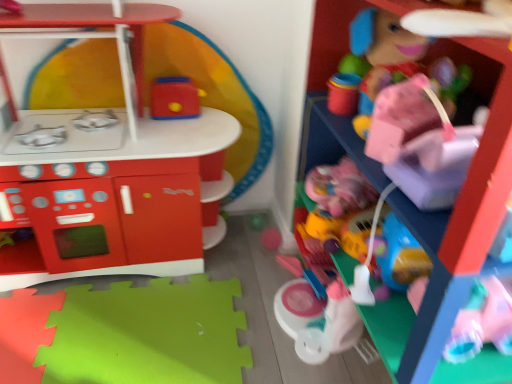
Question: Visually, is matte plastic toaster at upper center, which is the third toy in right-to-left order, positioned to the left or to the right of matte plastic play kitchen at left, positioned as the fourth toy in right-to-left order?

Choices:
 (A) right
 (B) left

Answer: (A)

Question: Is matte plastic toaster at upper center, which is the second toy in left-to-right order, inside or outside of matte plastic play kitchen at left, positioned as the fourth toy in right-to-left order?

Choices:
 (A) inside
 (B) outside

Answer: (A)

Question: Which is farther from the matte plastic play kitchen at left, positioned as the fourth toy in right-to-left order?

Choices:
 (A) matte plastic toy car at right, which is the second toy from right to left
 (B) pink plastic toy at upper right, the 1th toy viewed from the right
 (C) matte plastic toaster at upper center, which is the third toy in right-to-left order

Answer: (B)

Question: Considering the real-world distances, which object is closest to the matte plastic toy car at right, which is the second toy from right to left?

Choices:
 (A) pink plastic toy at upper right, the 1th toy viewed from the right
 (B) matte plastic toaster at upper center, which is the third toy in right-to-left order
 (C) matte plastic play kitchen at left, which ranks as the 1th toy in left-to-right order

Answer: (A)